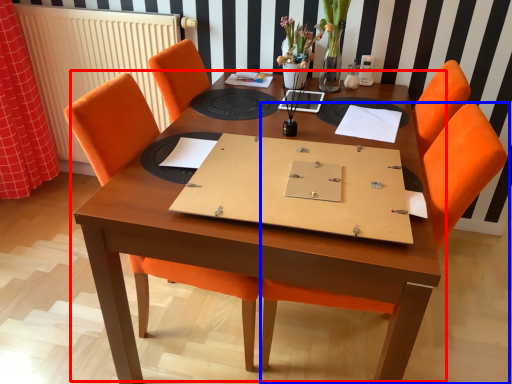
Question: Which object is closer to the camera taking this photo, table (highlighted by a red box) or chair (highlighted by a blue box)?

Choices:
 (A) table
 (B) chair

Answer: (A)